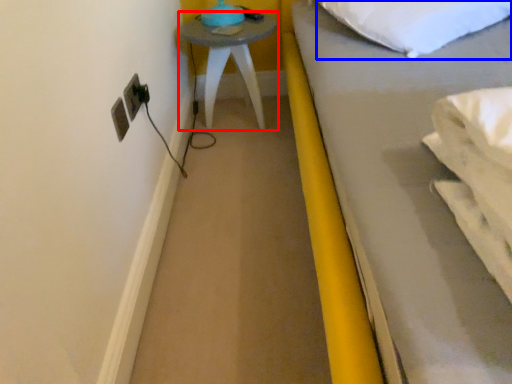
Question: Which of the following is the farthest to the observer, furniture (highlighted by a red box) or pillow (highlighted by a blue box)?

Choices:
 (A) furniture
 (B) pillow

Answer: (A)